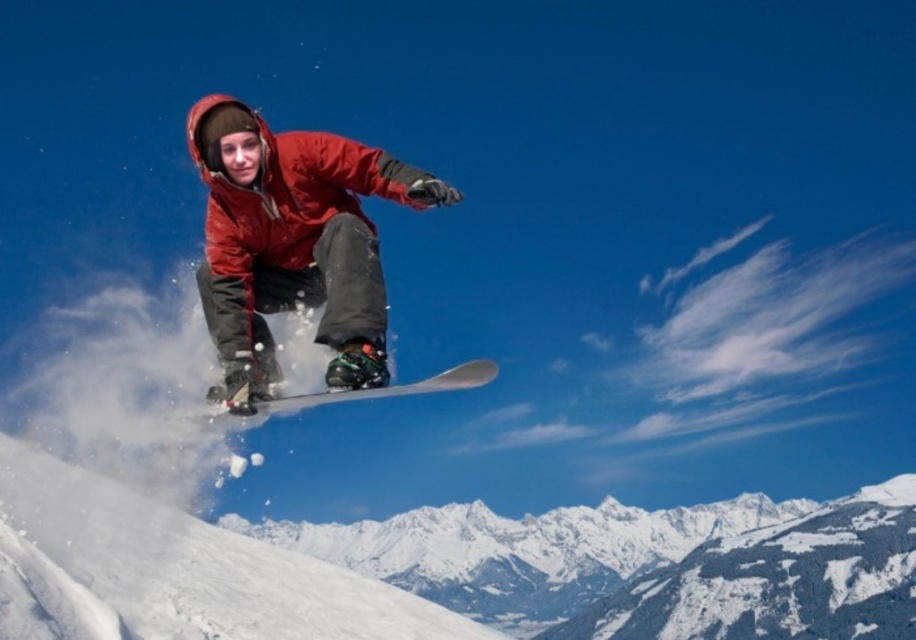
Question: Which point appears closest to the camera in this image?

Choices:
 (A) (477, 364)
 (B) (249, 221)

Answer: (A)

Question: Is matte red snowboarder at center above white glossy snowboard at center?

Choices:
 (A) yes
 (B) no

Answer: (A)

Question: Is the position of matte red snowboarder at center more distant than that of white glossy snowboard at center?

Choices:
 (A) no
 (B) yes

Answer: (A)

Question: Which of the following is the farthest from the observer?

Choices:
 (A) (213, 413)
 (B) (249, 228)

Answer: (A)

Question: Does matte red snowboarder at center have a greater width compared to white glossy snowboard at center?

Choices:
 (A) no
 (B) yes

Answer: (B)

Question: Which of the following is the closest to the observer?

Choices:
 (A) matte red snowboarder at center
 (B) white glossy snowboard at center

Answer: (A)